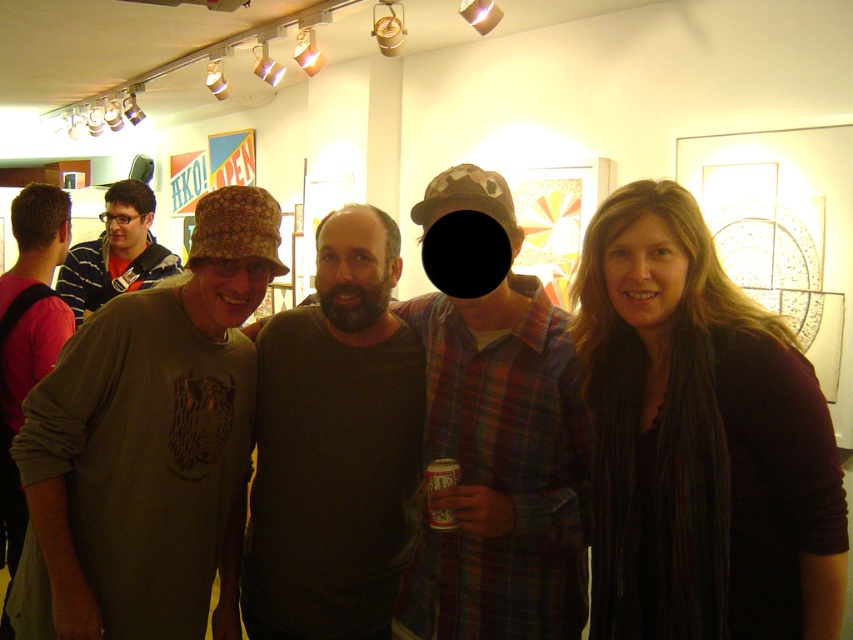
You are a photographer trying to capture a group photo of the five people in the scene. You want to ensure that everyone is in focus. The camera you are using has a depth of field that can cover 1.2 meters. Given the distance between the dark brown scarf at center and the nearest person, will your camera be able to capture everyone in focus?

The distance between the dark brown scarf at center and the nearest person is 1.15 meters, which is within the camera depth of field of 1.2 meters. Therefore, the camera can capture everyone in focus.